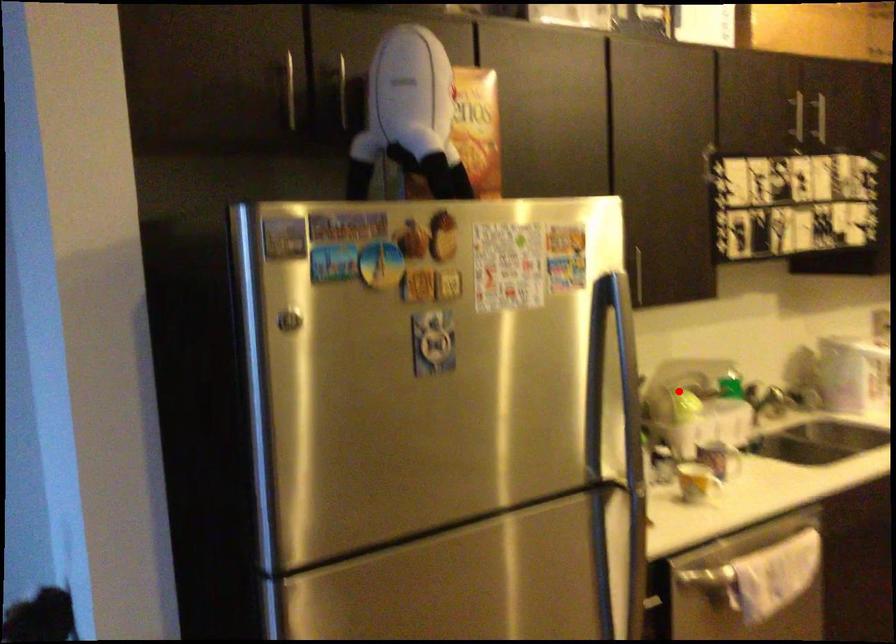
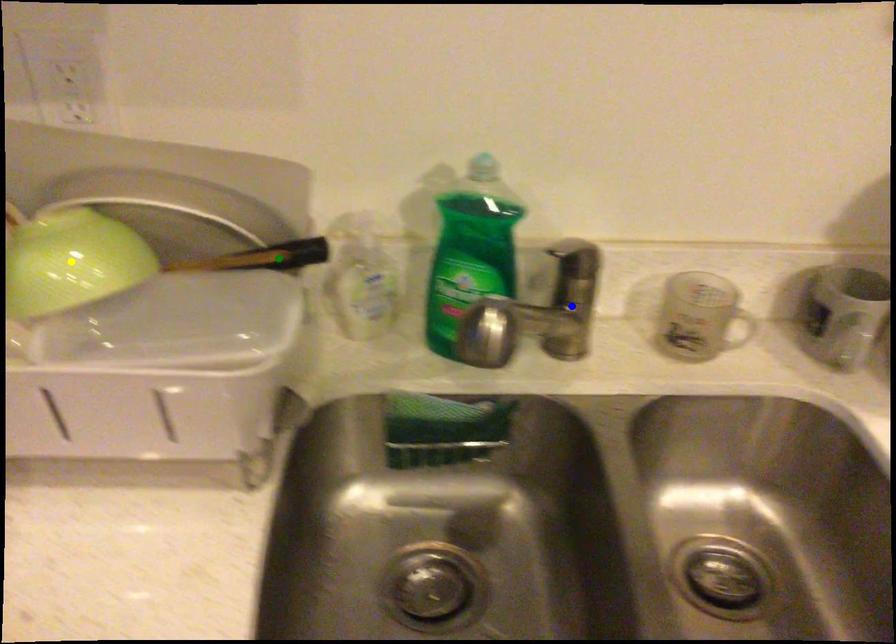
Question: I am providing you with two images of the same scene from different viewpoints. A red point is marked on the first image. You are given multiple points on the second image. Which point in image 2 is actually the same real-world point as the red point in image 1?

Choices:
 (A) yellow point
 (B) blue point
 (C) green point

Answer: (A)